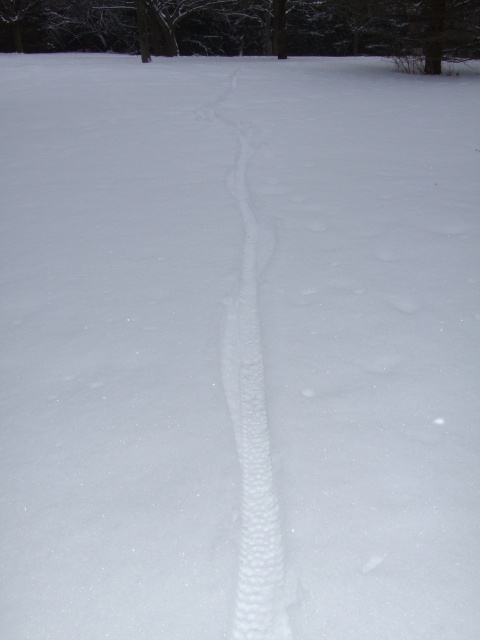
Question: Which object is farther from the camera taking this photo?

Choices:
 (A) brown textured tree at upper center
 (B) white textured snow trail at center

Answer: (A)

Question: Considering the relative positions of brown textured tree at upper center and white textured snow trail at center in the image provided, where is brown textured tree at upper center located with respect to white textured snow trail at center?

Choices:
 (A) right
 (B) left

Answer: (A)

Question: From the image, what is the correct spatial relationship of brown textured tree at upper center in relation to white textured snow trail at center?

Choices:
 (A) left
 (B) right

Answer: (B)

Question: Which object appears closest to the camera in this image?

Choices:
 (A) brown textured tree at upper center
 (B) white textured snow trail at center

Answer: (B)

Question: Considering the relative positions of brown textured tree at upper center and white textured snow trail at center in the image provided, where is brown textured tree at upper center located with respect to white textured snow trail at center?

Choices:
 (A) below
 (B) above

Answer: (B)